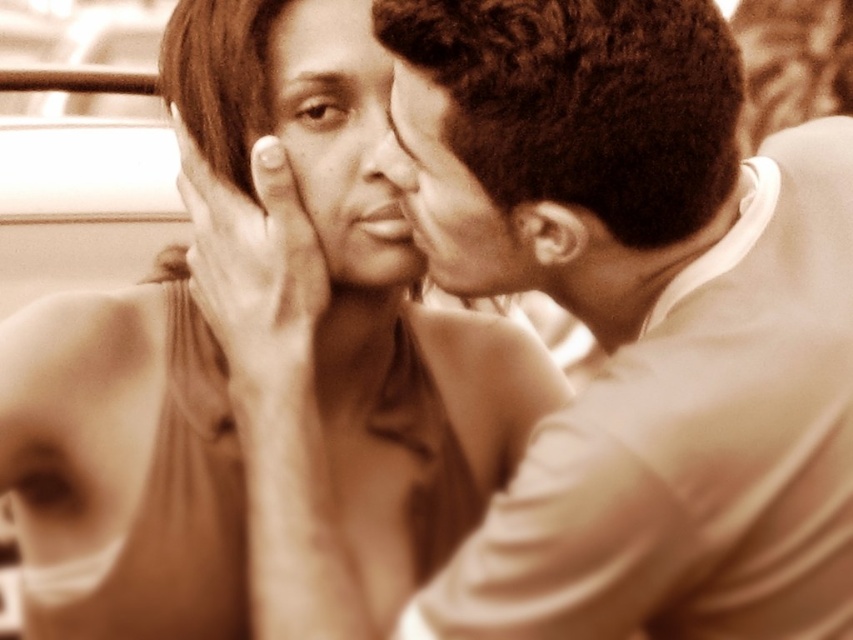
Question: Does smooth beige shirt at right appear over smooth skin nose at center?

Choices:
 (A) no
 (B) yes

Answer: (A)

Question: Which object is positioned farthest from the smooth beige shirt at right?

Choices:
 (A) smooth skin forehead at upper center
 (B) smooth beige dress at center
 (C) smooth skin face at center

Answer: (A)

Question: In this image, where is smooth skin face at center located relative to smooth skin nose at center?

Choices:
 (A) below
 (B) above

Answer: (B)

Question: Estimate the real-world distances between objects in this image. Which object is farther from the smooth skin hand at center?

Choices:
 (A) smooth skin nose at center
 (B) smooth beige dress at center

Answer: (A)

Question: Can you confirm if smooth skin hand at center is thinner than smooth skin nose at center?

Choices:
 (A) no
 (B) yes

Answer: (A)

Question: Estimate the real-world distances between objects in this image. Which object is closer to the smooth beige shirt at right?

Choices:
 (A) smooth skin forehead at upper center
 (B) smooth skin face at center
 (C) smooth skin hand at center
 (D) smooth skin face at upper right

Answer: (D)